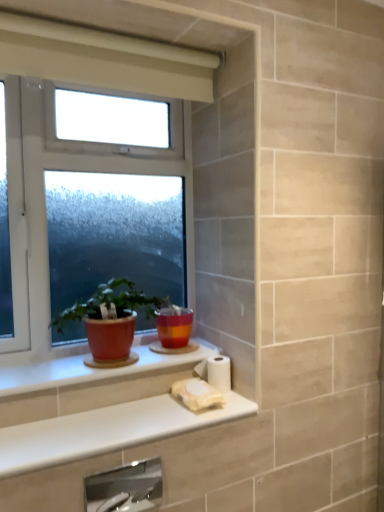
Where is `free space to the left of white matte toilet paper at lower center, the 2th toilet paper in the top-to-bottom sequence`? free space to the left of white matte toilet paper at lower center, the 2th toilet paper in the top-to-bottom sequence is located at coordinates (148, 407).